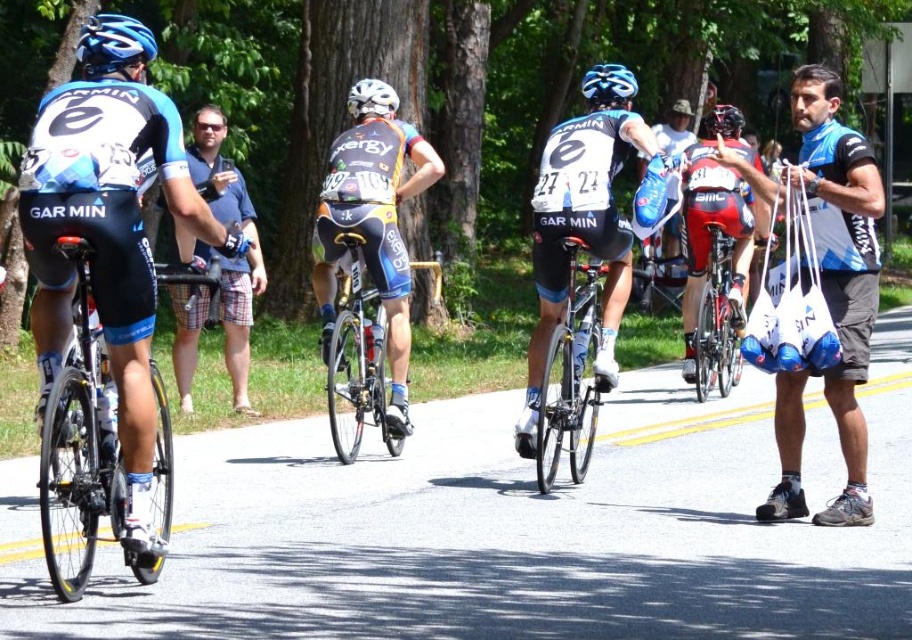
Question: Which object appears farthest from the camera in this image?

Choices:
 (A) blue jersey at right
 (B) red matte jersey at center
 (C) blue matte bicycle helmet at upper center

Answer: (B)

Question: Which of the following is the farthest from the observer?

Choices:
 (A) blue matte bicycle helmet at upper left
 (B) blue jersey at right
 (C) matte black jersey at center

Answer: (C)

Question: From the image, what is the correct spatial relationship of shiny black frame at left in relation to shiny blue jersey at center?

Choices:
 (A) above
 (B) below

Answer: (B)

Question: Observing the image, what is the correct spatial positioning of shiny blue jersey at center in reference to blue matte bicycle helmet at upper left?

Choices:
 (A) below
 (B) above

Answer: (A)

Question: Does blue plaid shorts at left appear under black matte helmet at center?

Choices:
 (A) no
 (B) yes

Answer: (B)

Question: Estimate the real-world distances between objects in this image. Which object is farther from the shiny black frame at left?

Choices:
 (A) blue jersey at right
 (B) black matte helmet at center

Answer: (B)